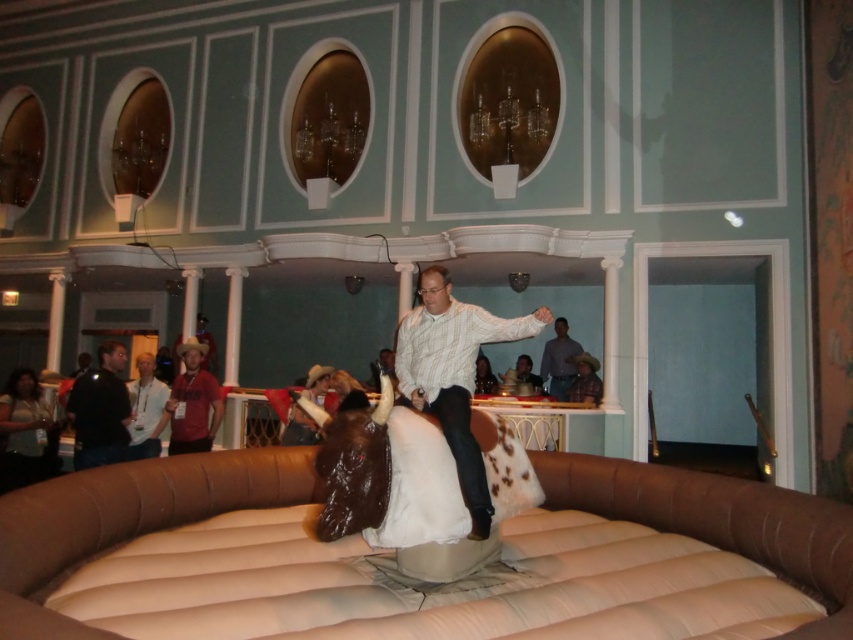
Between black leather jacket at left and brown leather cowboy hat at center, which one appears on the right side from the viewer's perspective?

brown leather cowboy hat at center

Can you confirm if black leather jacket at left is positioned above brown leather cowboy hat at center?

Yes.

Is point (109, 348) in front of point (314, 394)?

Yes, point (109, 348) is closer to viewer.

Where is `black leather jacket at left`? Image resolution: width=853 pixels, height=640 pixels. black leather jacket at left is located at coordinates (100, 410).

Is black leather jacket at left positioned at the back of brown leather jacket at center?

No, it is in front of brown leather jacket at center.

Does black leather jacket at left appear under brown leather jacket at center?

Correct, black leather jacket at left is located below brown leather jacket at center.

Is point (120, 381) farther from viewer compared to point (556, 332)?

No.

I want to click on black leather jacket at left, so click(100, 410).

Is striped cotton shirt at center closer to camera compared to matte red shirt at lower left?

Yes, striped cotton shirt at center is closer to the viewer.

Can you confirm if striped cotton shirt at center is positioned to the left of matte red shirt at lower left?

No, striped cotton shirt at center is not to the left of matte red shirt at lower left.

The height and width of the screenshot is (640, 853). Find the location of `striped cotton shirt at center`. striped cotton shirt at center is located at coordinates (453, 374).